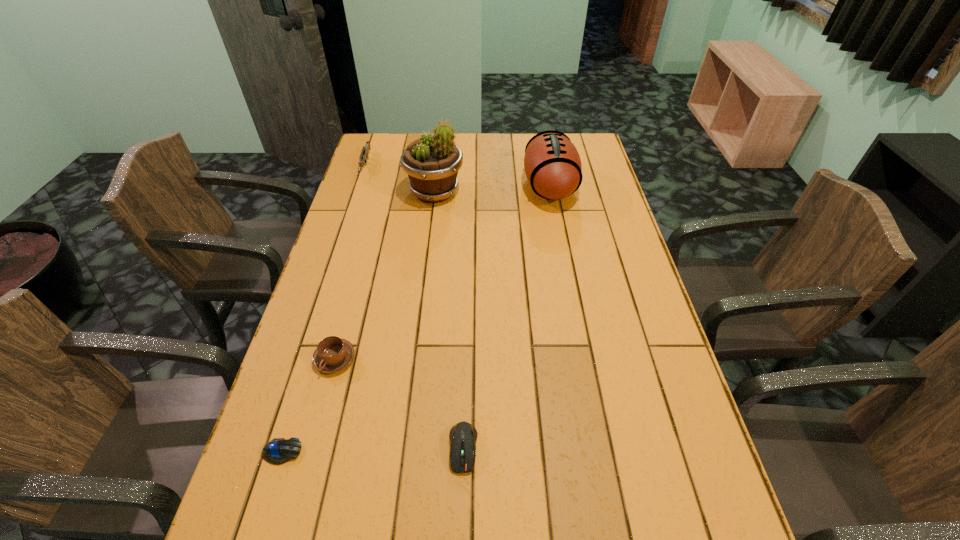
Where is `vacant region located 0.300m on the front of the flowerpot`? vacant region located 0.300m on the front of the flowerpot is located at coordinates (425, 273).

Locate an element on the screen. Image resolution: width=960 pixels, height=540 pixels. free point located on the left of the fifth shortest object is located at coordinates (506, 186).

At what (x,y) coordinates should I click in order to perform the action: click on vacant space located 0.110m aimed along the barrel of the third tallest object. Please return your answer as a coordinate pair (x, y). The image size is (960, 540). Looking at the image, I should click on (354, 199).

Identify the location of free point located 0.120m on the side of the cappuccino with the handle. This screenshot has height=540, width=960. (317, 424).

This screenshot has height=540, width=960. In order to click on vacant region located on the button of the right computer mouse in this screenshot , I will do `click(462, 512)`.

Where is `free spot located on the button side of the shortest object`? free spot located on the button side of the shortest object is located at coordinates (441, 451).

You are a GUI agent. You are given a task and a screenshot of the screen. Output one action in this format:
    pyautogui.click(x=<x>, y=<y>)
    Task: Click on the football (American) that is at the far edge
    
    Given the screenshot: What is the action you would take?
    pyautogui.click(x=552, y=164)

What are the coordinates of `gun positioned at the far edge` in the screenshot? It's located at (364, 156).

What are the coordinates of `gun situated at the left edge` in the screenshot? It's located at (364, 156).

Where is `cappuccino that is at the left edge`? cappuccino that is at the left edge is located at coordinates (333, 354).